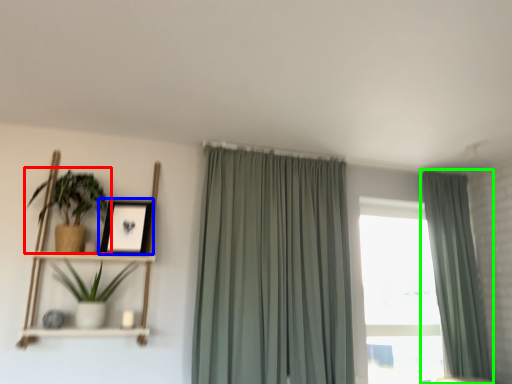
Question: Which object is positioned farthest from houseplant (highlighted by a red box)? Select from picture frame (highlighted by a blue box) and curtain (highlighted by a green box).

Choices:
 (A) picture frame
 (B) curtain

Answer: (B)